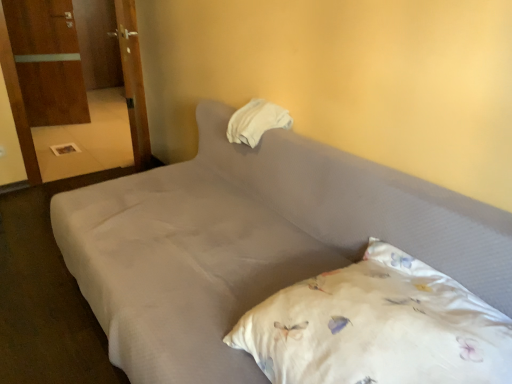
Question: Can you confirm if white floral pillow at lower right, acting as the 1th pillow starting from the bottom, is bigger than gray fabric bed at center?

Choices:
 (A) no
 (B) yes

Answer: (A)

Question: Is white floral pillow at lower right, acting as the 1th pillow starting from the bottom, next to gray fabric bed at center?

Choices:
 (A) yes
 (B) no

Answer: (B)

Question: Considering the relative sizes of white floral pillow at lower right, the second pillow in the top-to-bottom sequence, and gray fabric bed at center in the image provided, is white floral pillow at lower right, the second pillow in the top-to-bottom sequence, thinner than gray fabric bed at center?

Choices:
 (A) yes
 (B) no

Answer: (A)

Question: Is white floral pillow at lower right, the second pillow in the top-to-bottom sequence, aimed at gray fabric bed at center?

Choices:
 (A) yes
 (B) no

Answer: (A)

Question: Is the position of white floral pillow at lower right, marked as the 1th pillow in a front-to-back arrangement, more distant than that of gray fabric bed at center?

Choices:
 (A) yes
 (B) no

Answer: (A)

Question: From a real-world perspective, is wooden armoire at left, placed as the 1th armoire when sorted from back to front, above or below wooden door at left, arranged as the 1th armoire when viewed from the front?

Choices:
 (A) below
 (B) above

Answer: (A)

Question: Is wooden armoire at left, which is the 1th armoire from left to right, taller or shorter than wooden door at left, arranged as the 1th armoire when viewed from the front?

Choices:
 (A) short
 (B) tall

Answer: (A)

Question: Is wooden armoire at left, the second armoire positioned from the front, spatially inside wooden door at left, marked as the first armoire in a right-to-left arrangement, or outside of it?

Choices:
 (A) outside
 (B) inside

Answer: (A)

Question: Based on their positions, is wooden armoire at left, the second armoire positioned from the front, located to the left or right of wooden door at left, marked as the first armoire in a right-to-left arrangement?

Choices:
 (A) left
 (B) right

Answer: (A)

Question: Looking at their shapes, would you say white floral pillow at lower right, the second pillow in the top-to-bottom sequence, is wider or thinner than wooden armoire at left, which is the 1th armoire from left to right?

Choices:
 (A) wide
 (B) thin

Answer: (A)

Question: Considering the positions of white floral pillow at lower right, the second pillow in the top-to-bottom sequence, and wooden armoire at left, the second armoire positioned from the front, in the image, is white floral pillow at lower right, the second pillow in the top-to-bottom sequence, bigger or smaller than wooden armoire at left, the second armoire positioned from the front,?

Choices:
 (A) big
 (B) small

Answer: (A)

Question: In the image, is white floral pillow at lower right, the second pillow in the top-to-bottom sequence, on the left side or the right side of wooden armoire at left, which is the 1th armoire from left to right?

Choices:
 (A) right
 (B) left

Answer: (A)

Question: In terms of height, does white floral pillow at lower right, acting as the 1th pillow starting from the bottom, look taller or shorter compared to wooden armoire at left, which is the 1th armoire from left to right?

Choices:
 (A) short
 (B) tall

Answer: (A)

Question: In terms of height, does gray fabric bed at center look taller or shorter compared to wooden armoire at left, placed as the 1th armoire when sorted from back to front?

Choices:
 (A) tall
 (B) short

Answer: (B)

Question: Is gray fabric bed at center in front of or behind wooden armoire at left, positioned as the second armoire in right-to-left order, in the image?

Choices:
 (A) front
 (B) behind

Answer: (A)